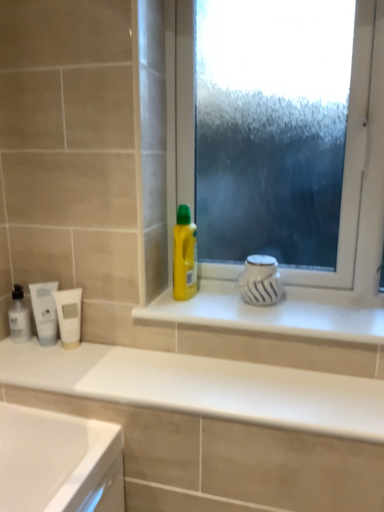
Find the location of a particular element. vacant space in front of white glossy jar at center is located at coordinates (274, 318).